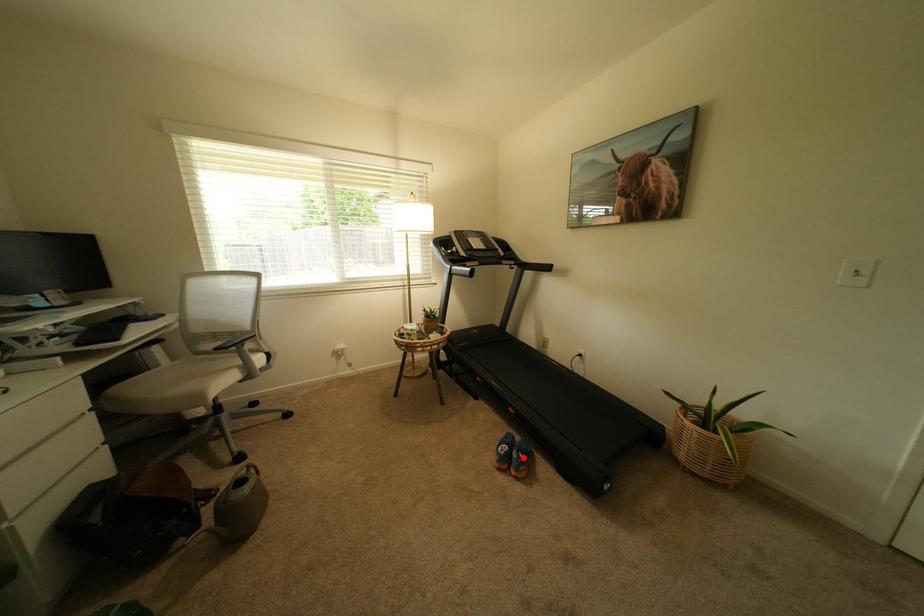
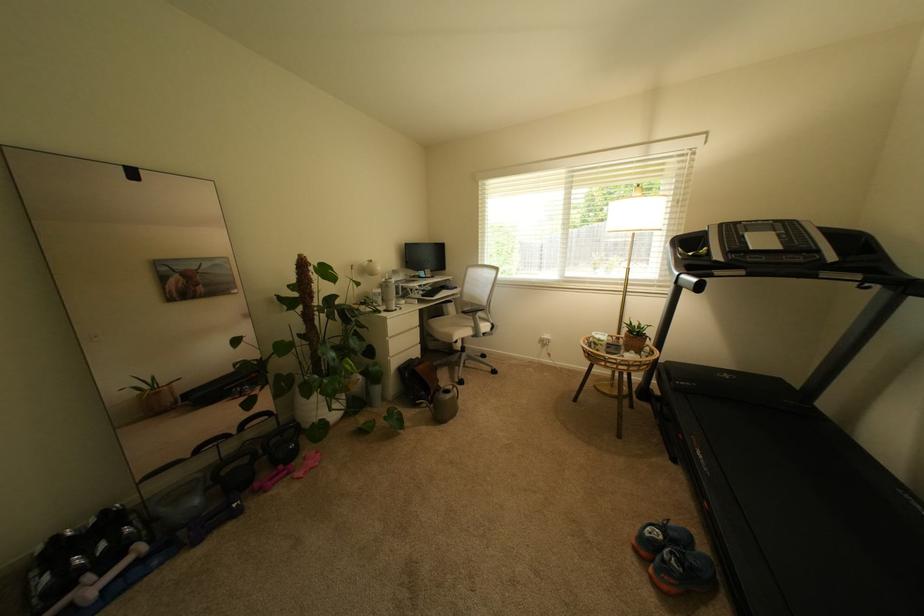
Question: I am providing you with two images of the same scene from different viewpoints. Given a red point in image1, look at the same physical point in image2. Is it:

Choices:
 (A) Closer to the viewpoint
 (B) Farther from the viewpoint

Answer: (B)